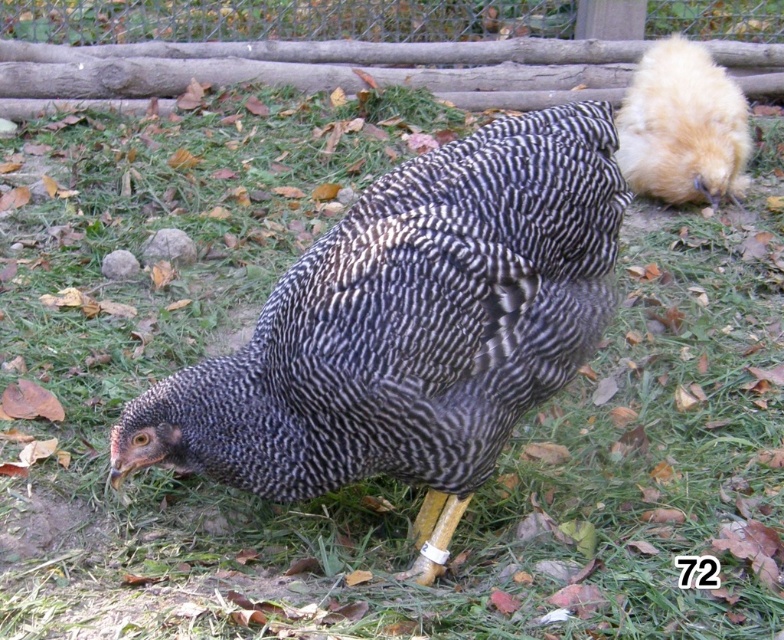
Image resolution: width=784 pixels, height=640 pixels. What do you see at coordinates (409, 326) in the screenshot?
I see `speckled feathered chicken at center` at bounding box center [409, 326].

Who is lower down, speckled feathered chicken at center or wooden fence at upper center?

Positioned lower is speckled feathered chicken at center.

Is point (223, 428) more distant than point (42, 44)?

No, it is not.

The height and width of the screenshot is (640, 784). Find the location of `speckled feathered chicken at center`. speckled feathered chicken at center is located at coordinates (409, 326).

Which is more to the right, wooden fence at upper center or golden fluffy chicken at upper right?

golden fluffy chicken at upper right is more to the right.

Who is more distant from viewer, [162,81] or [721,99]?

The point [162,81] is behind.

Locate an element on the screen. wooden fence at upper center is located at coordinates (314, 68).

Between speckled feathered chicken at center and golden fluffy chicken at upper right, which one is positioned lower?

speckled feathered chicken at center

Describe the element at coordinates (409, 326) in the screenshot. I see `speckled feathered chicken at center` at that location.

Locate an element on the screen. The width and height of the screenshot is (784, 640). speckled feathered chicken at center is located at coordinates (409, 326).